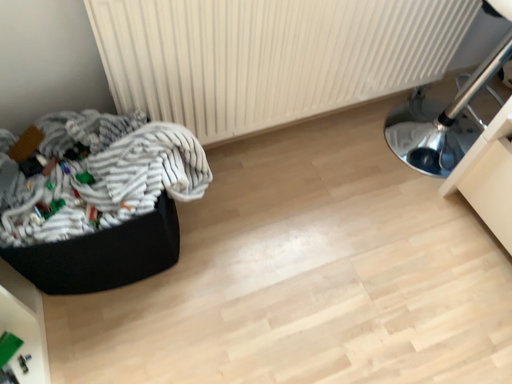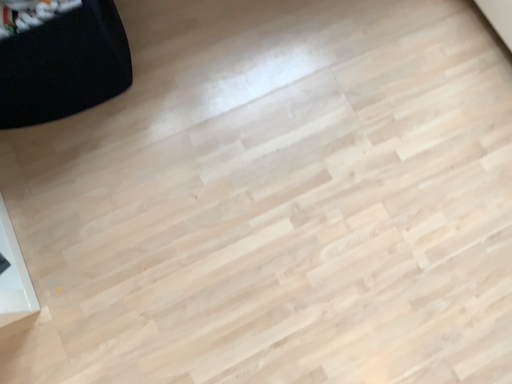
Question: Which way did the camera rotate in the video?

Choices:
 (A) rotated upward
 (B) rotated downward

Answer: (B)